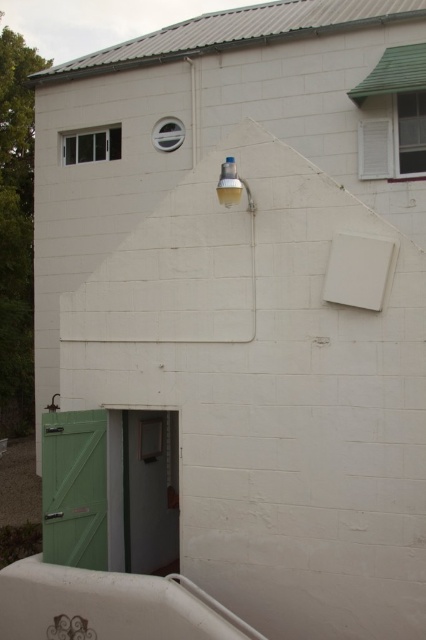
You are standing in front of the white building described. There is a green matte door at lower left located at point (74, 488). Where is the green matte door at lower left relative to the rectangular window with horizontal bar on the left side of the building?

The green matte door at lower left is located below the rectangular window with horizontal bar on the left side of the building.